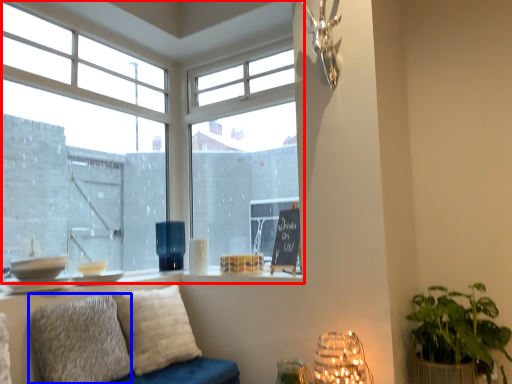
Question: Which object is further to the camera taking this photo, window (highlighted by a red box) or pillow (highlighted by a blue box)?

Choices:
 (A) window
 (B) pillow

Answer: (A)